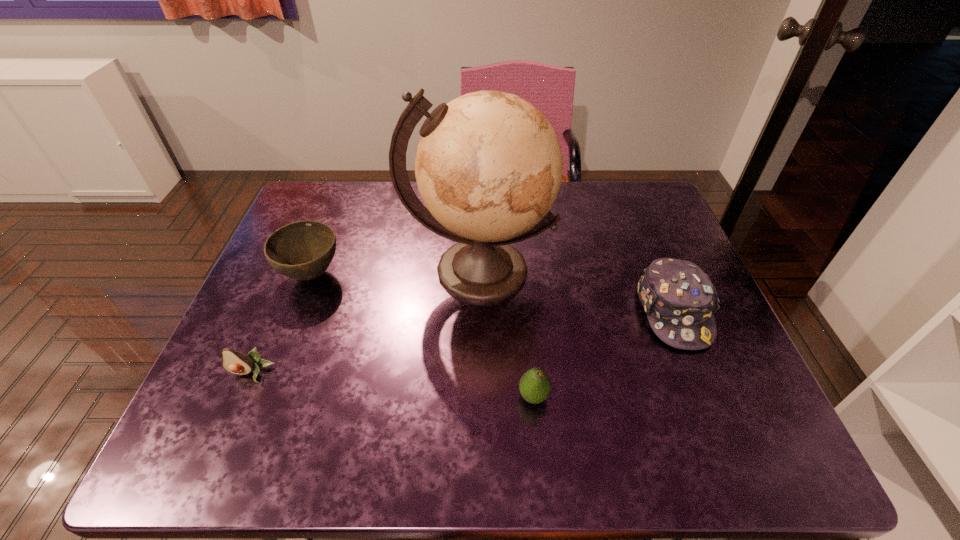
The width and height of the screenshot is (960, 540). Identify the location of globe. (489, 166).

Where is `bowl`? bowl is located at coordinates (303, 250).

You are a GUI agent. You are given a task and a screenshot of the screen. Output one action in this format:
    pyautogui.click(x=<x>, y=<y>)
    Task: Click on the headwear
    The width and height of the screenshot is (960, 540).
    Given the screenshot: What is the action you would take?
    pyautogui.click(x=680, y=300)

Image resolution: width=960 pixels, height=540 pixels. I want to click on the farther avocado, so click(236, 362).

Where is `the fourth farthest object`? the fourth farthest object is located at coordinates (236, 362).

This screenshot has width=960, height=540. What are the coordinates of `the nearer avocado` in the screenshot? It's located at (535, 385).

Identify the location of the right avocado. The height and width of the screenshot is (540, 960). (535, 385).

I want to click on vacant region located 0.150m on the front-facing side of the tallest object, so click(x=479, y=370).

The image size is (960, 540). I want to click on free space located on the right of the bowl, so click(418, 275).

The width and height of the screenshot is (960, 540). Identify the location of vacant space located on the front-facing side of the rightmost object. (732, 456).